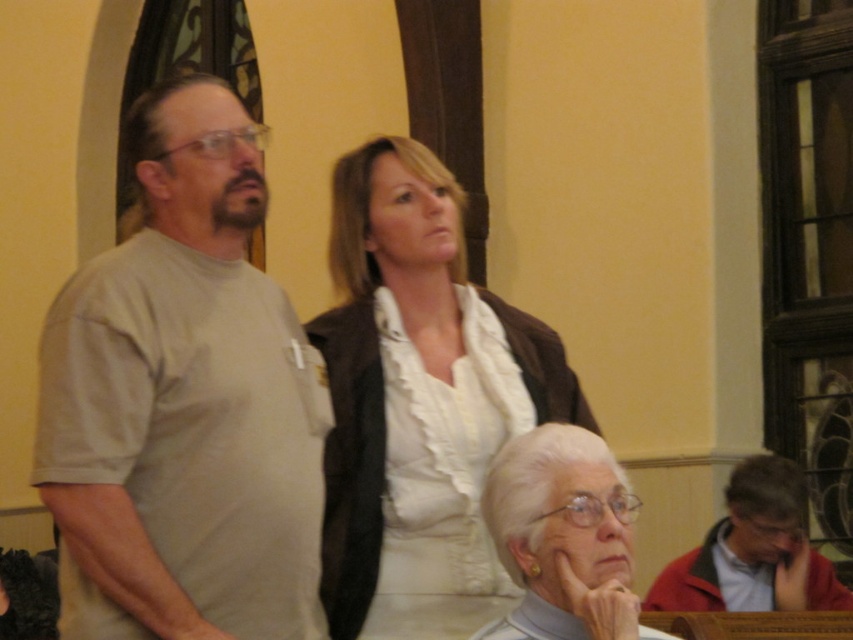
Question: In this image, where is light gray t-shirt at left located relative to red jacket at lower right?

Choices:
 (A) left
 (B) right

Answer: (A)

Question: Does light gray t-shirt at left appear over white matte blouse at center?

Choices:
 (A) no
 (B) yes

Answer: (B)

Question: Which point appears farthest from the camera in this image?

Choices:
 (A) (508, 588)
 (B) (606, 516)
 (C) (781, 465)
 (D) (231, 268)

Answer: (C)

Question: Which point is closer to the camera?

Choices:
 (A) white matte blouse at center
 (B) red jacket at lower right
 (C) light gray t-shirt at left
 (D) white fabric at lower center

Answer: (D)

Question: Which object is farther from the camera taking this photo?

Choices:
 (A) white matte blouse at center
 (B) white fabric at lower center

Answer: (A)

Question: Can you confirm if white matte blouse at center is positioned above red jacket at lower right?

Choices:
 (A) yes
 (B) no

Answer: (A)